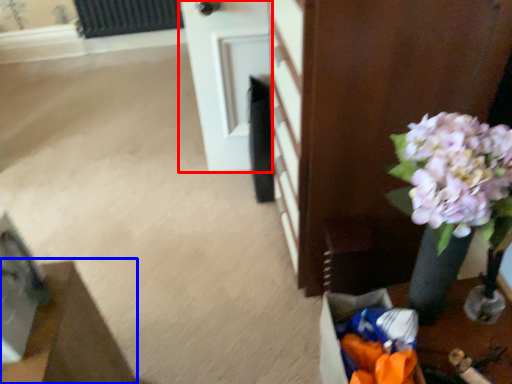
Question: Which point is further to the camera, door (highlighted by a red box) or furniture (highlighted by a blue box)?

Choices:
 (A) door
 (B) furniture

Answer: (A)